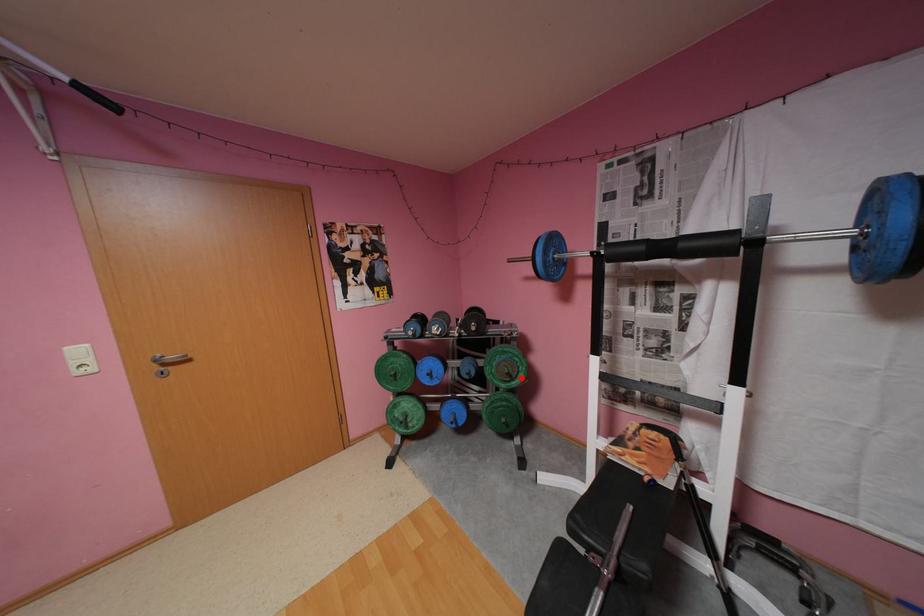
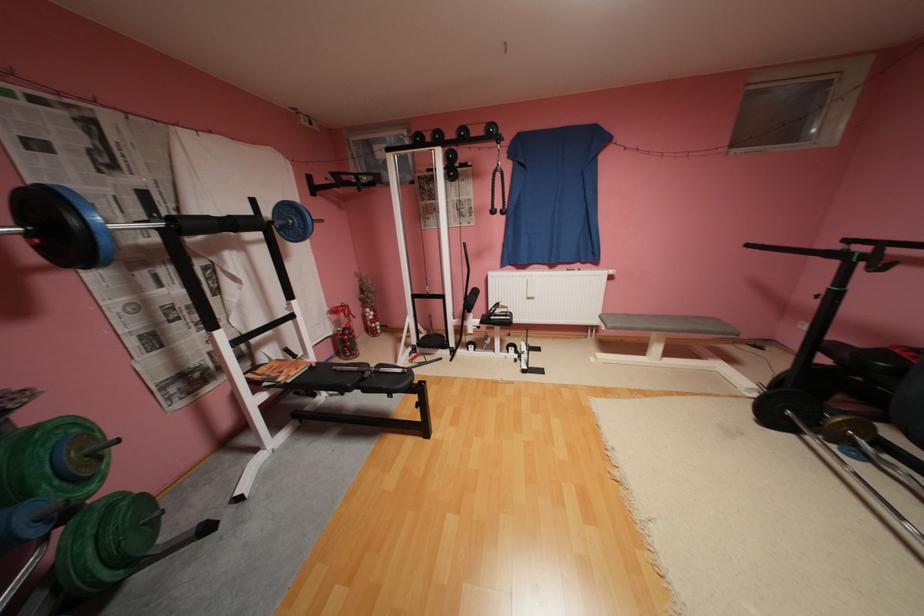
In the second image, find the point that corresponds to the highlighted location in the first image.

(111, 459)